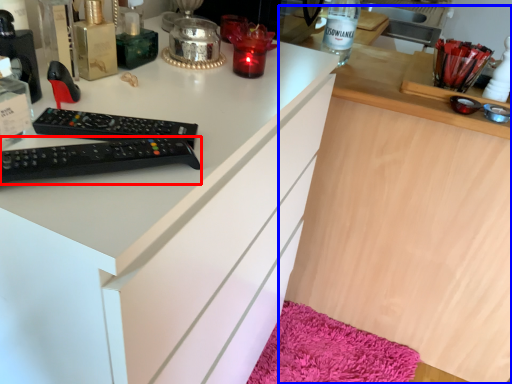
Question: Which point is closer to the camera, remote control (highlighted by a red box) or computer (highlighted by a blue box)?

Choices:
 (A) remote control
 (B) computer

Answer: (A)